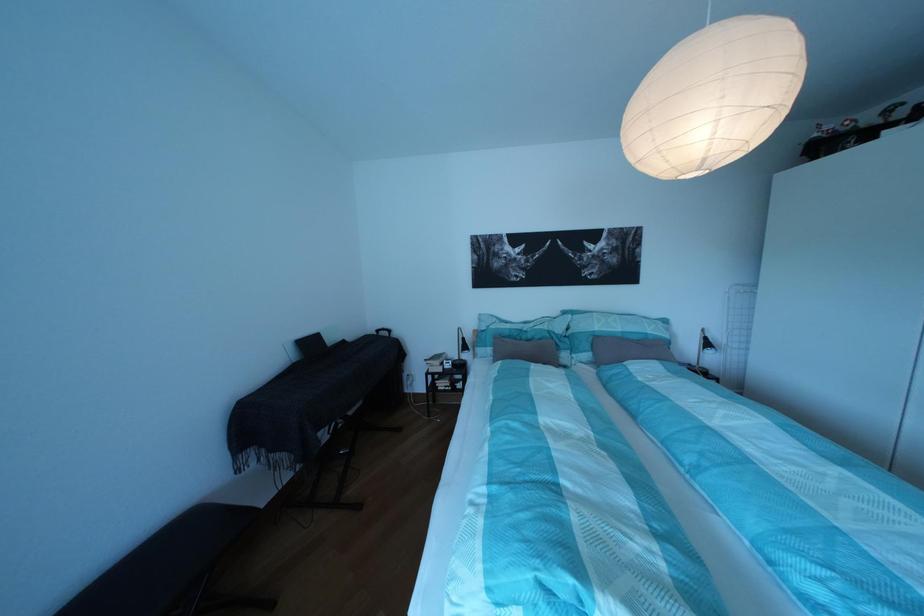
Which object does [435,362] point to?

This point indicates the stack of books.